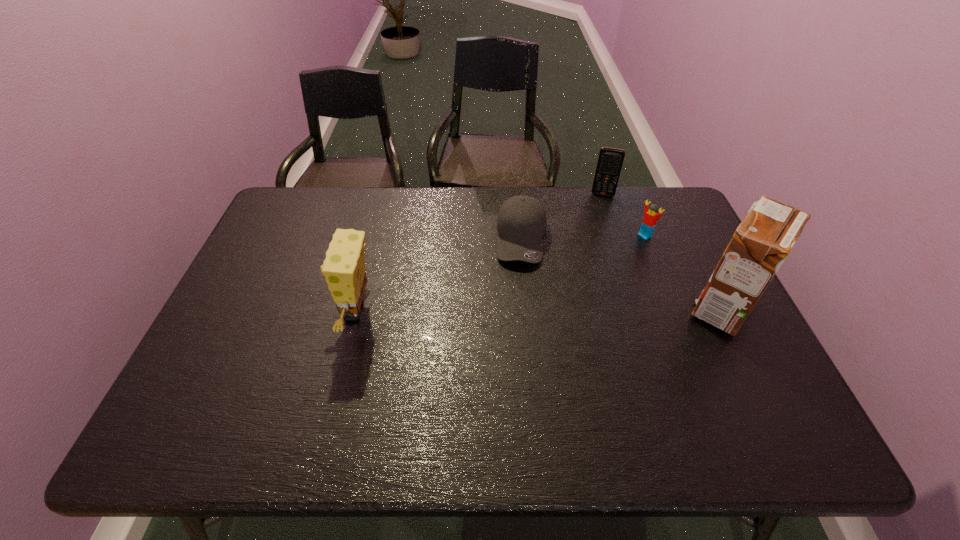
Image resolution: width=960 pixels, height=540 pixels. I want to click on vacant space on the desktop that is between the leftmost object and the tallest object and is positioned on the front brim of the second object from left to right, so click(522, 310).

Image resolution: width=960 pixels, height=540 pixels. What are the coordinates of `free spot on the desktop that is between the second tallest object and the tallest object and is positioned on the face of the Lego` in the screenshot? It's located at (524, 310).

The height and width of the screenshot is (540, 960). I want to click on vacant spot on the desktop that is between the leftmost object and the rightmost object and is positioned on the screen of the farthest object, so click(584, 309).